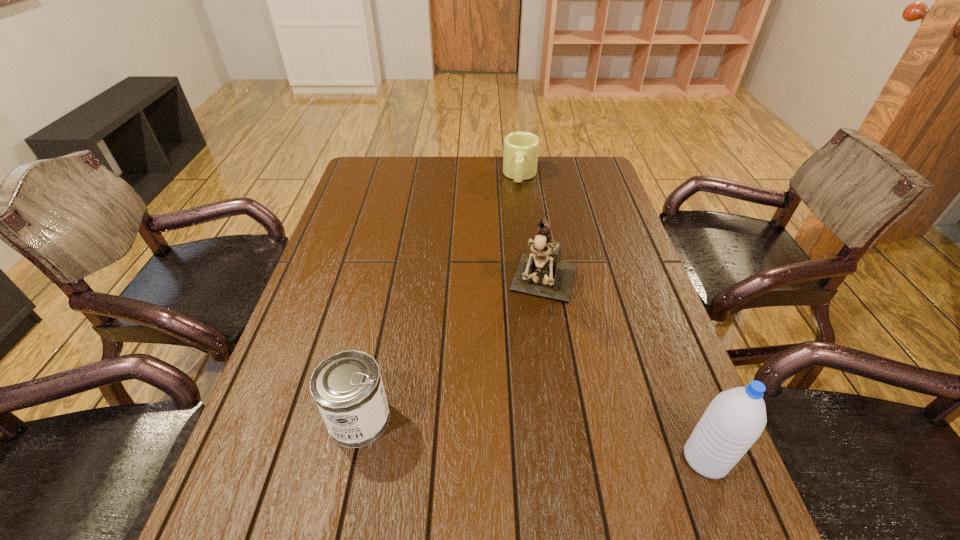
The height and width of the screenshot is (540, 960). Identify the location of the leftmost object. (347, 387).

Locate an element on the screen. The height and width of the screenshot is (540, 960). the rightmost object is located at coordinates (734, 420).

Find the location of a particular element. Image resolution: width=960 pixels, height=540 pixels. water bottle is located at coordinates (734, 420).

The width and height of the screenshot is (960, 540). Identify the location of mug. (521, 149).

Where is `figurine`? This screenshot has width=960, height=540. figurine is located at coordinates (542, 274).

Identify the location of the tallest object. (542, 274).

Where is `vacant space situated on the back of the can`? The width and height of the screenshot is (960, 540). vacant space situated on the back of the can is located at coordinates (384, 303).

Identify the location of vacant space situated 0.320m on the left of the rightmost object. (515, 458).

Find the location of a particular element. The width and height of the screenshot is (960, 540). blank area located with the handle on the side of the farthest object is located at coordinates (511, 260).

I want to click on free space located 0.090m with the handle on the side of the farthest object, so click(517, 203).